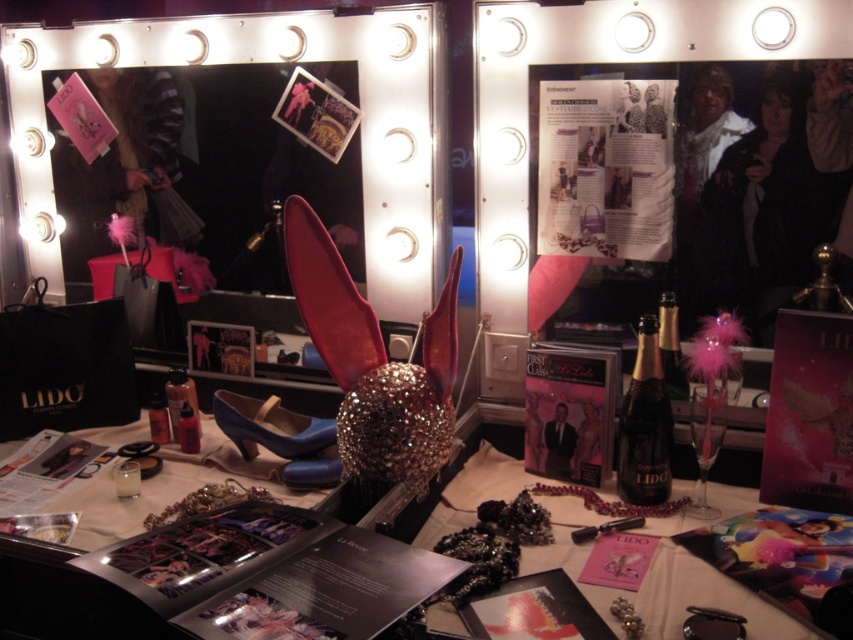
Question: Does metallic silver mirror at center have a greater width compared to blue patent leather shoe at center?

Choices:
 (A) no
 (B) yes

Answer: (B)

Question: Which object appears closest to the camera in this image?

Choices:
 (A) blue patent leather shoe at center
 (B) metallic silver mirror at center

Answer: (A)

Question: Does metallic silver mirror at center come behind blue patent leather shoe at center?

Choices:
 (A) no
 (B) yes

Answer: (B)

Question: Among these objects, which one is nearest to the camera?

Choices:
 (A) blue patent leather shoe at center
 (B) metallic silver mirror at center

Answer: (A)

Question: Can you confirm if metallic silver mirror at center is positioned to the right of blue patent leather shoe at center?

Choices:
 (A) no
 (B) yes

Answer: (A)

Question: Which object is closer to the camera taking this photo?

Choices:
 (A) blue patent leather shoe at center
 (B) metallic silver mirror at center

Answer: (A)